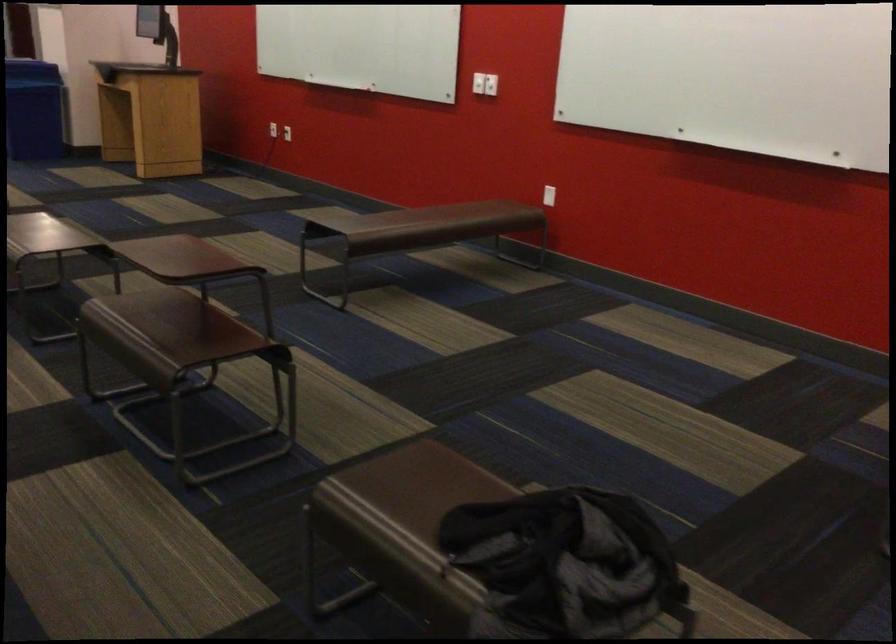
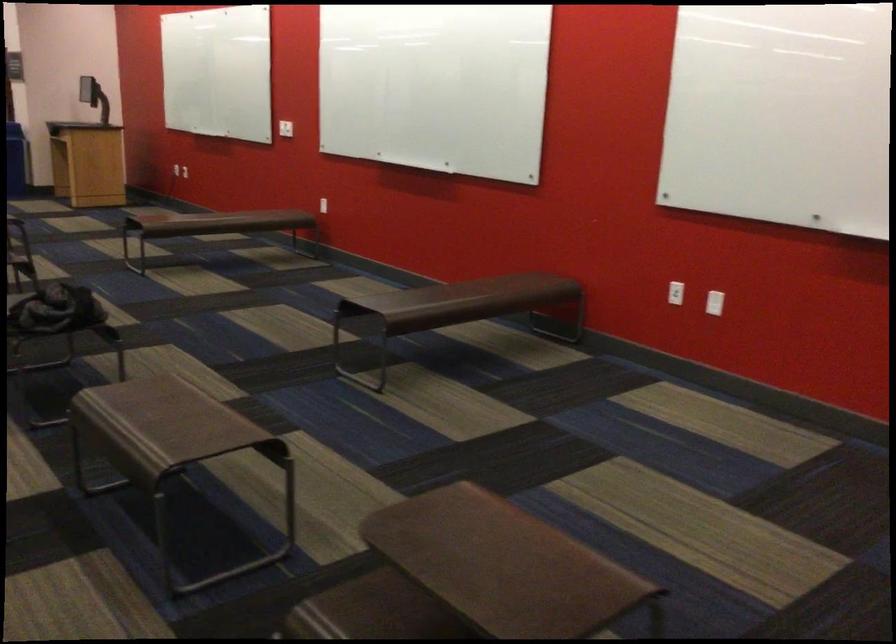
Where in the second image is the point corresponding to (x=535, y=176) from the first image?

(323, 205)